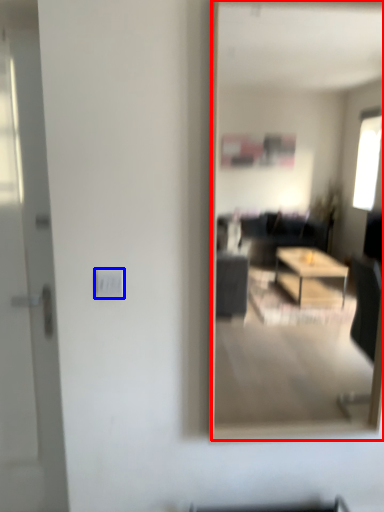
Question: Which object is closer to the camera taking this photo, mirror (highlighted by a red box) or electric outlet (highlighted by a blue box)?

Choices:
 (A) mirror
 (B) electric outlet

Answer: (A)